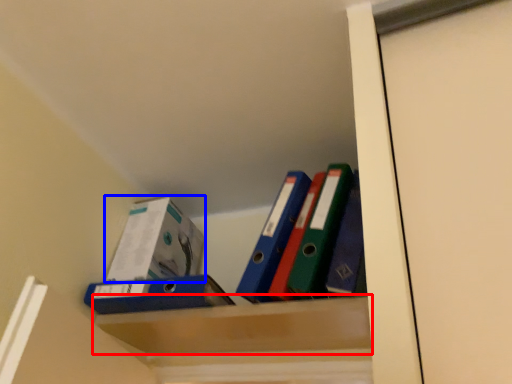
Question: Which of the following is the closest to the observer, cabinet (highlighted by a red box) or box (highlighted by a blue box)?

Choices:
 (A) cabinet
 (B) box

Answer: (A)